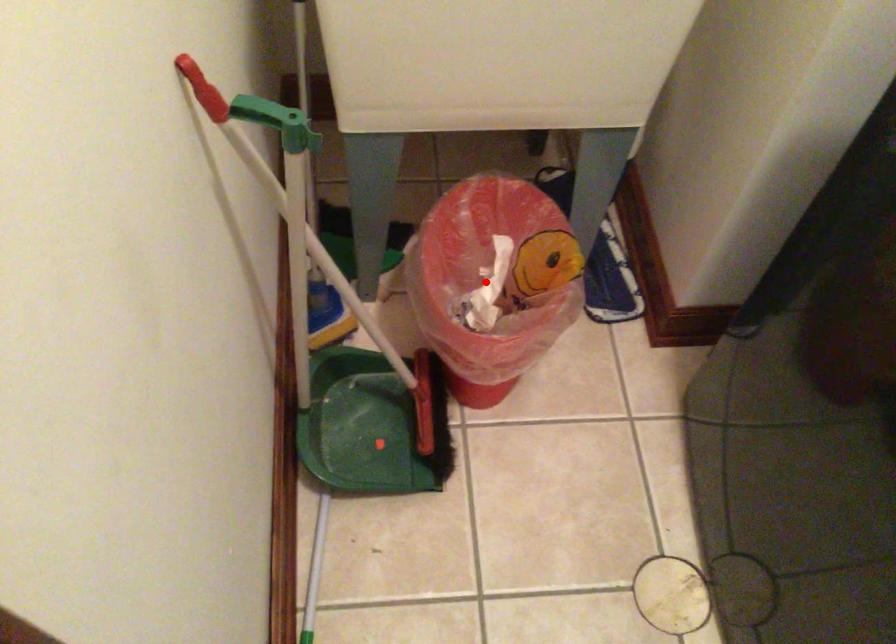
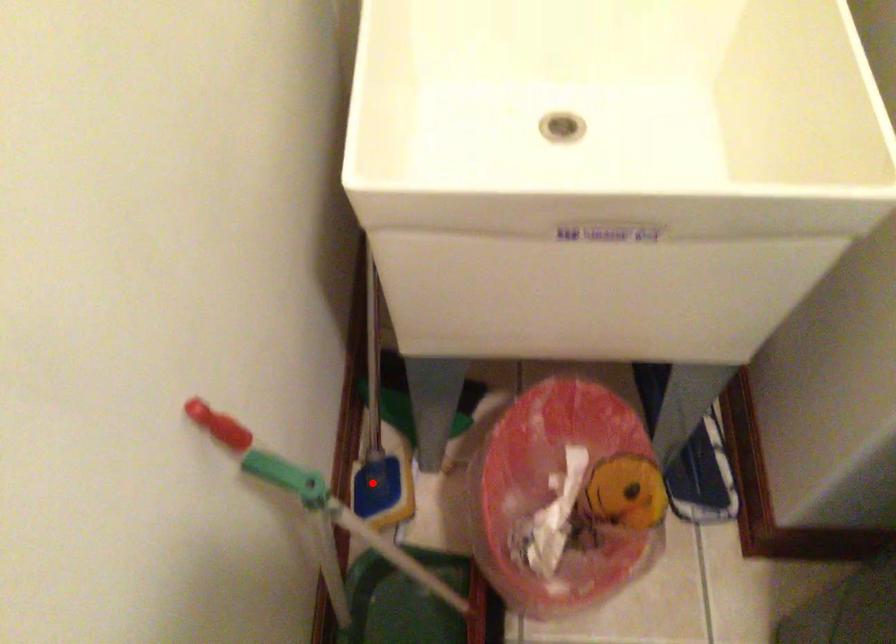
I am providing you with two images of the same scene from different viewpoints. A red point is marked on the first image and another point is marked on the second image. Do the highlighted points in image1 and image2 indicate the same real-world spot?

No